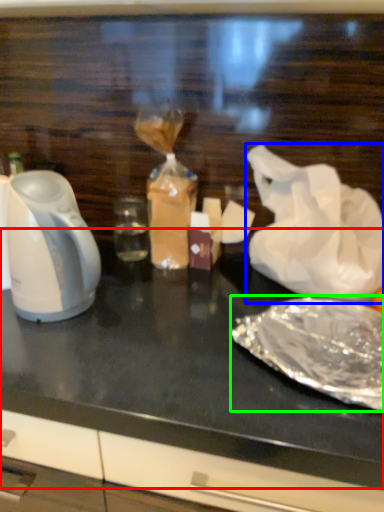
Question: Which object is positioned closest to table top (highlighted by a red box)? Select from plastic bag (highlighted by a blue box) and food (highlighted by a green box).

Choices:
 (A) plastic bag
 (B) food

Answer: (B)